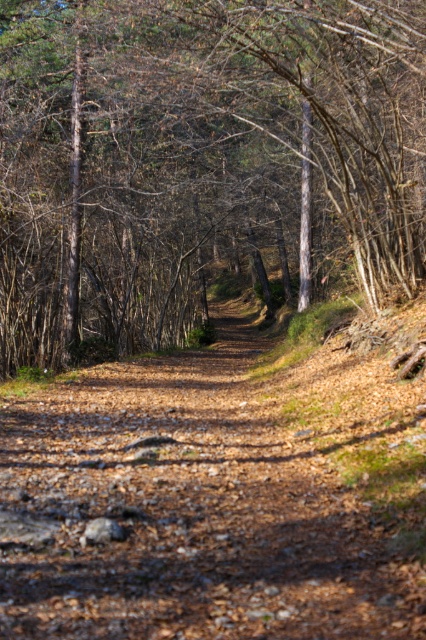
You are a hiker walking along the brown dirt track at center and want to know if you can pass through the area between two brown bark tree at center. Can you fit through the space between them?

The brown bark tree at center has a larger width than the brown dirt track at center, so the space between the two trees is narrower than the track itself. Therefore, you can fit through the space between them as long as your path stays within the track width.

You are standing on the brown dirt track at center and want to look up at the brown bark tree at center. Which direction should you look to see the tree?

The brown bark tree at center is above the brown dirt track at center, so you should look upward to see the tree.

You are standing at the point marked as point [201,161] in the forest path. Which object are you touching?

You are touching the brown bark tree at center because the point [201,161] is located on it.